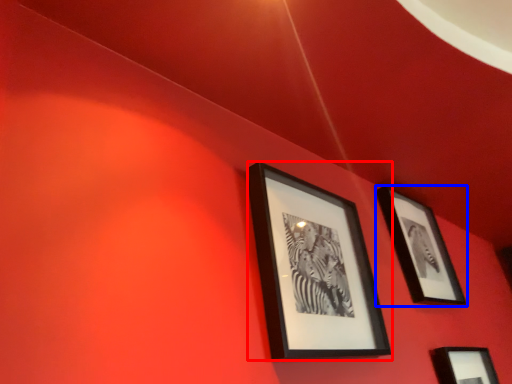
Question: Which object appears farthest to the camera in this image, picture frame (highlighted by a red box) or picture frame (highlighted by a blue box)?

Choices:
 (A) picture frame
 (B) picture frame

Answer: (B)